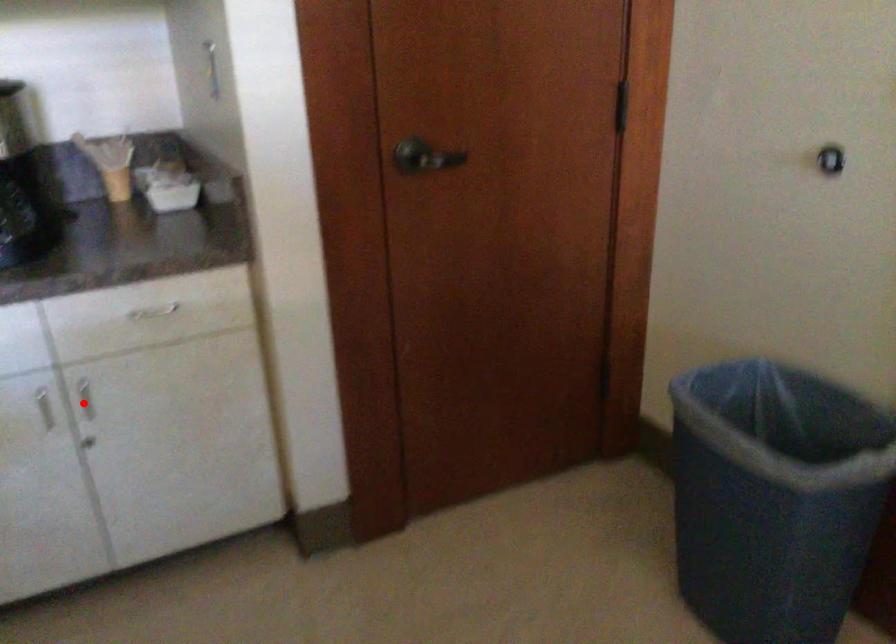
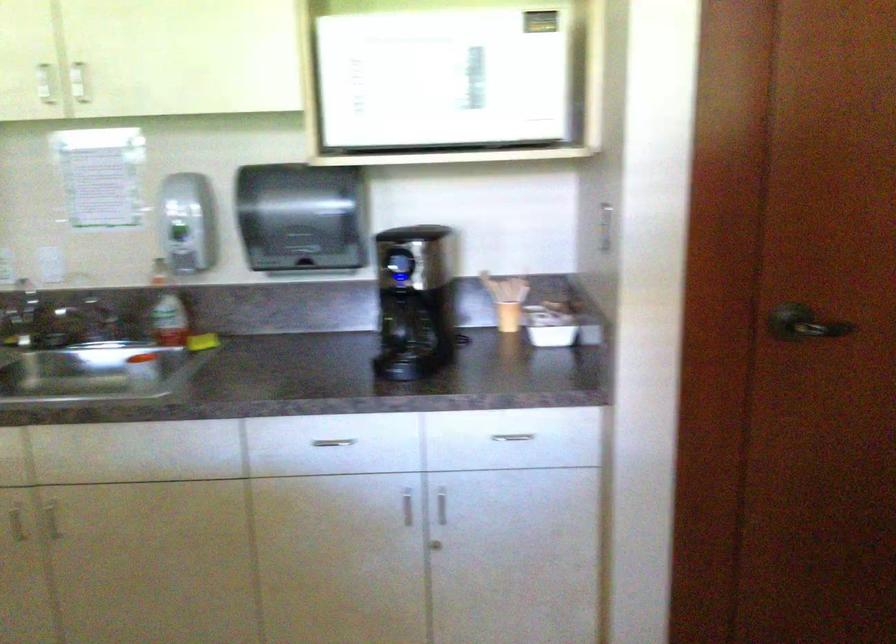
The point at the highlighted location is marked in the first image. Where is the corresponding point in the second image?

(442, 506)